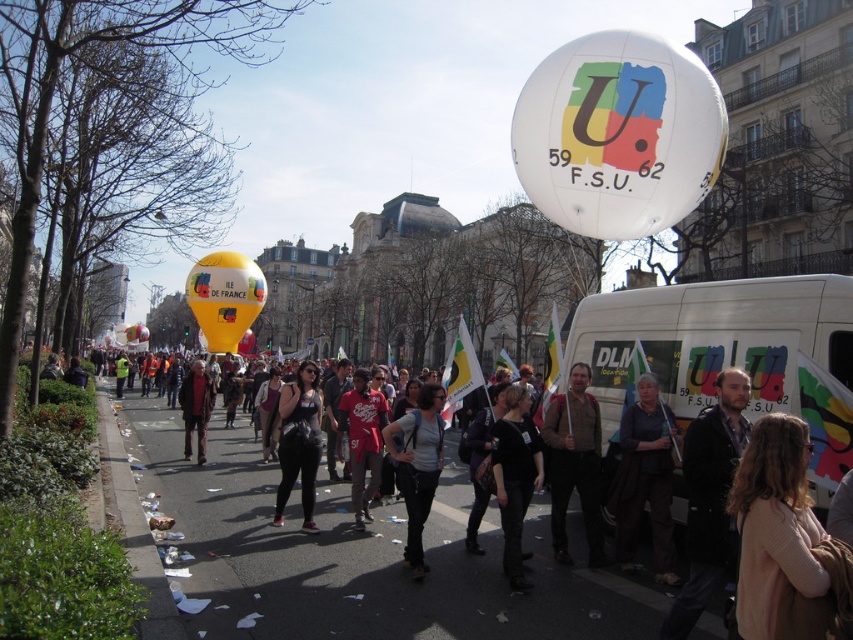
You are a photographer standing in the middle of the street. You want to take a photo that includes both the dark brown leather jacket at lower right and the yellowmatteballoon at left. Based on their positions, which object should you adjust your camera angle to focus on first to ensure both are in frame?

The dark brown leather jacket at lower right is below the yellowmatteballoon at left. To include both in the frame, you should first focus on the yellowmatteballoon at left, then adjust downward to include the dark brown leather jacket at lower right.

You are a photographer trying to capture a photo of the dark brown leather jacket at lower right and the dark gray jacket at center. From the perspective of someone standing in front of the crowd, which jacket is more to the right?

The dark brown leather jacket at lower right is more to the right because it is positioned on the right side of the dark gray jacket at center.